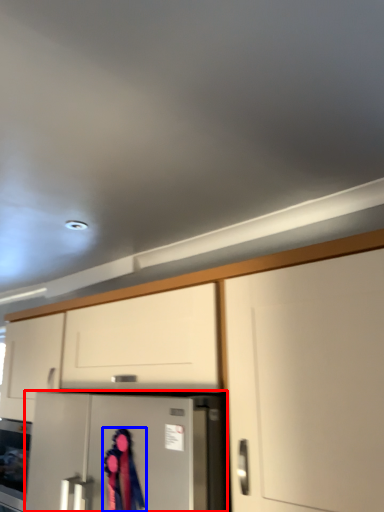
Question: Among these objects, which one is farthest to the camera, refrigerator (highlighted by a red box) or woman (highlighted by a blue box)?

Choices:
 (A) refrigerator
 (B) woman

Answer: (B)